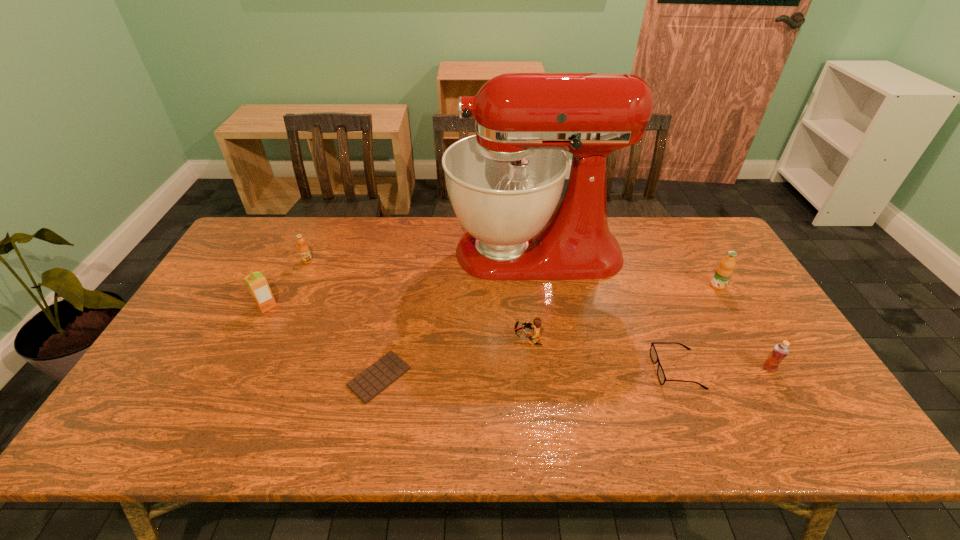
Where is `chocolate bar`? This screenshot has width=960, height=540. chocolate bar is located at coordinates (368, 384).

Where is `vacant region located at the attachment hub of the tallest object`? The height and width of the screenshot is (540, 960). vacant region located at the attachment hub of the tallest object is located at coordinates (411, 252).

The height and width of the screenshot is (540, 960). In order to click on blank area located 0.270m at the attachment hub of the tallest object in this screenshot , I will do `click(366, 252)`.

This screenshot has width=960, height=540. I want to click on vacant region located 0.100m at the attachment hub of the tallest object, so click(418, 252).

At what (x,y) coordinates should I click in order to perform the action: click on free space located 0.230m on the label of the second farthest orange juice. Please return your answer as a coordinate pair (x, y). The width and height of the screenshot is (960, 540). Looking at the image, I should click on (756, 352).

Image resolution: width=960 pixels, height=540 pixels. I want to click on vacant space situated on the left of the fifth nearest object, so click(232, 306).

Where is `blank space located on the front label of the seventh object from right to left`? Image resolution: width=960 pixels, height=540 pixels. blank space located on the front label of the seventh object from right to left is located at coordinates (268, 348).

Locate an element on the screen. Image resolution: width=960 pixels, height=540 pixels. free space located on the left of the nearest orange juice is located at coordinates (676, 368).

This screenshot has height=540, width=960. Find the location of `vacant space located 0.310m holding a crossbow in the hands of the Lego`. vacant space located 0.310m holding a crossbow in the hands of the Lego is located at coordinates (398, 339).

The height and width of the screenshot is (540, 960). Find the location of `free space located 0.380m holding a crossbow in the hands of the Lego`. free space located 0.380m holding a crossbow in the hands of the Lego is located at coordinates (372, 339).